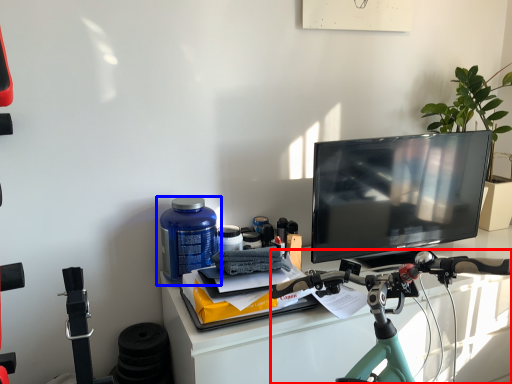
Question: Which object is closer to the camera taking this photo, bicycle (highlighted by a red box) or bottle (highlighted by a blue box)?

Choices:
 (A) bicycle
 (B) bottle

Answer: (A)